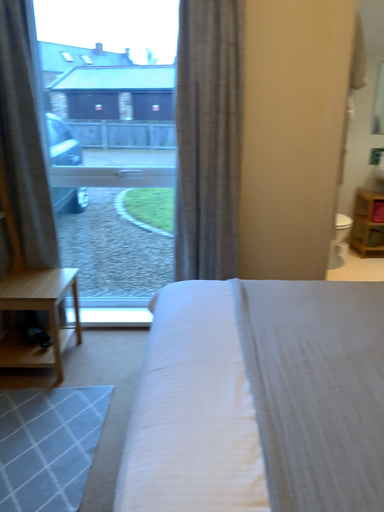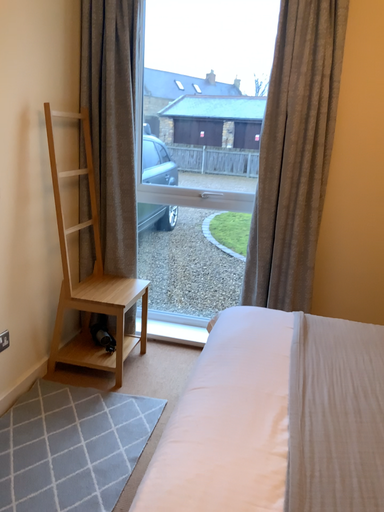
Question: Which way did the camera rotate in the video?

Choices:
 (A) rotated left
 (B) rotated right

Answer: (A)